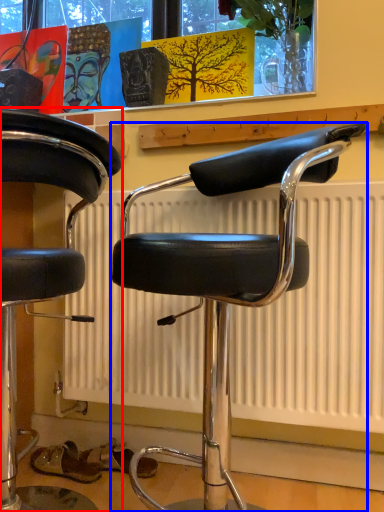
Question: Which object is further to the camera taking this photo, chair (highlighted by a red box) or chair (highlighted by a blue box)?

Choices:
 (A) chair
 (B) chair

Answer: (B)